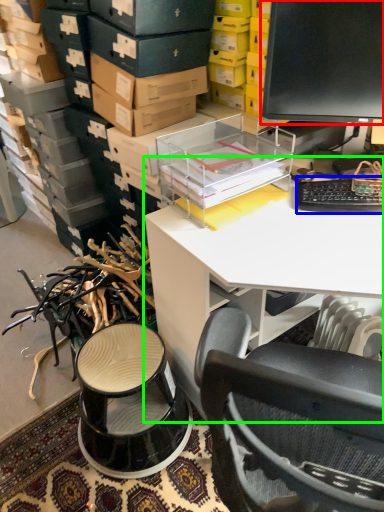
Question: Which is nearer to the computer monitor (highlighted by a red box)? computer keyboard (highlighted by a blue box) or desk (highlighted by a green box).

Choices:
 (A) computer keyboard
 (B) desk

Answer: (A)